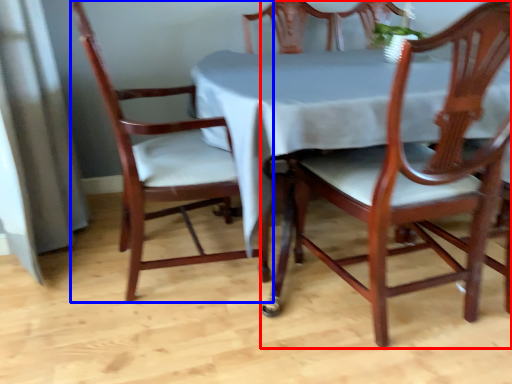
Question: Which object is closer to the camera taking this photo, chair (highlighted by a red box) or chair (highlighted by a blue box)?

Choices:
 (A) chair
 (B) chair

Answer: (A)